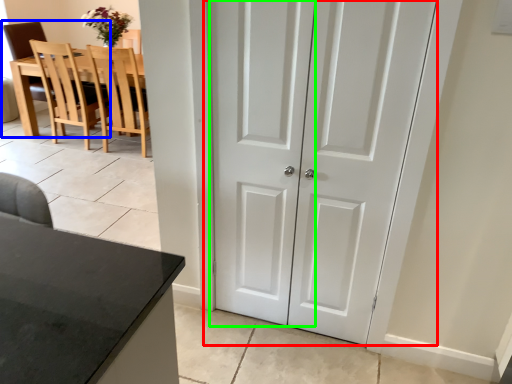
Question: Considering the real-world distances, which object is closest to door (highlighted by a red box)? chair (highlighted by a blue box) or screen door (highlighted by a green box).

Choices:
 (A) chair
 (B) screen door

Answer: (B)